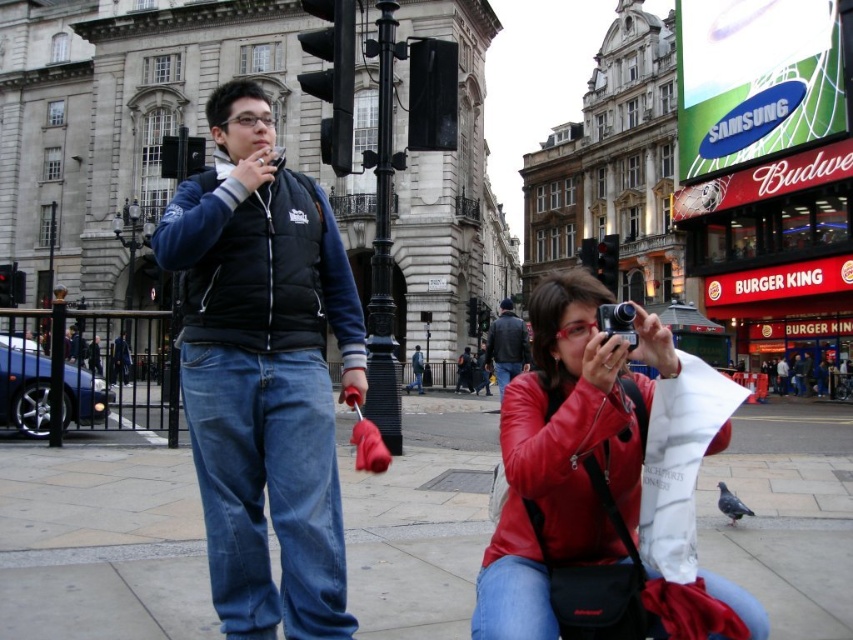
You are a photographer standing in the urban scene and want to adjust your equipment. Which item, the black matte vest at center or the leather jacket at center, would you need to reach further to touch?

The leather jacket at center is further away from the viewer than the black matte vest at center, so you would need to reach further to touch the leather jacket at center.

You are a photographer in the scene and need to adjust your position to avoid blocking the black matte vest at center. Which direction should you move to ensure it stays visible in your frame?

The black matte vest at center is located at point (263,372), so you should move away from that coordinate to keep it visible in your frame.

You are a photographer trying to capture a photo of both the black matte vest at center and the gray matte pigeon at lower right in the same frame. Given their sizes, which one will appear larger in your photo?

The black matte vest at center will appear larger in the photo because it has a larger size compared to the gray matte pigeon at lower right.